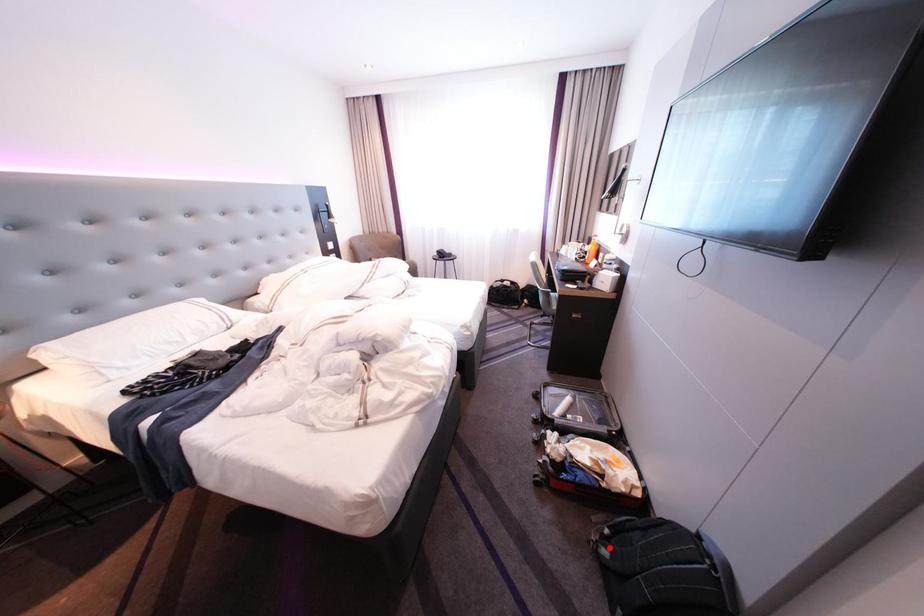
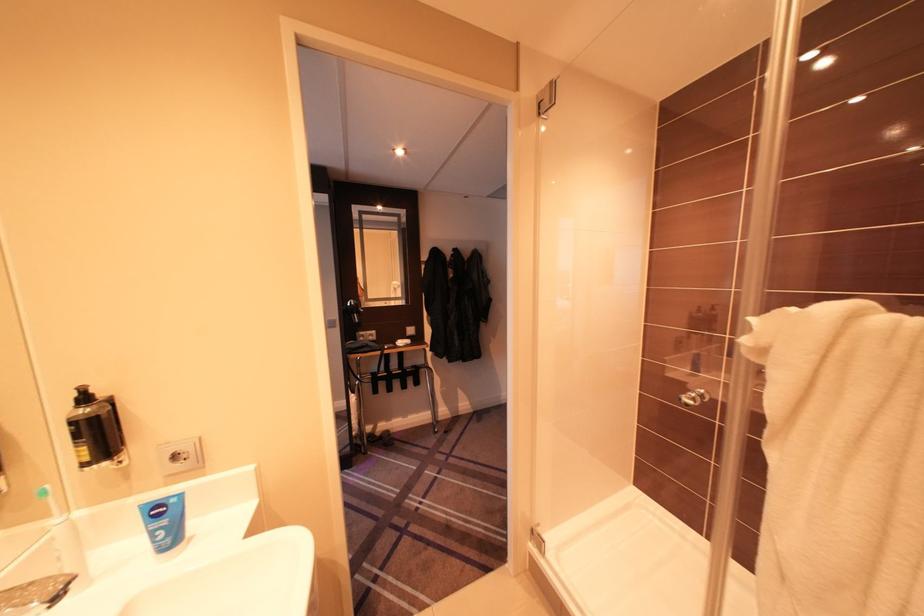
Question: I am providing you with two images of the same scene from different viewpoints. A red point is marked on the first image. At the location where the point appears in image 1, is it still visible in image 2?

Choices:
 (A) Yes
 (B) No

Answer: (B)